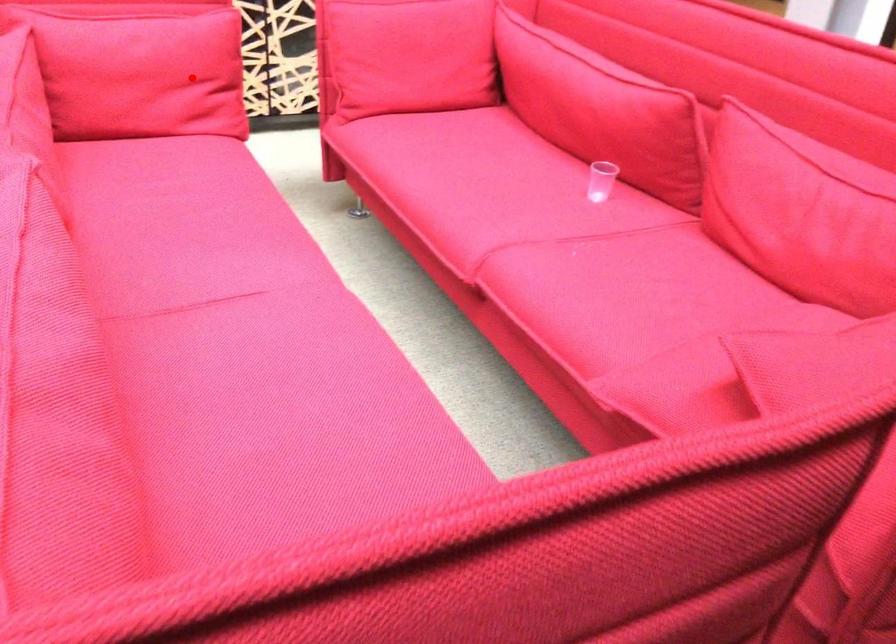
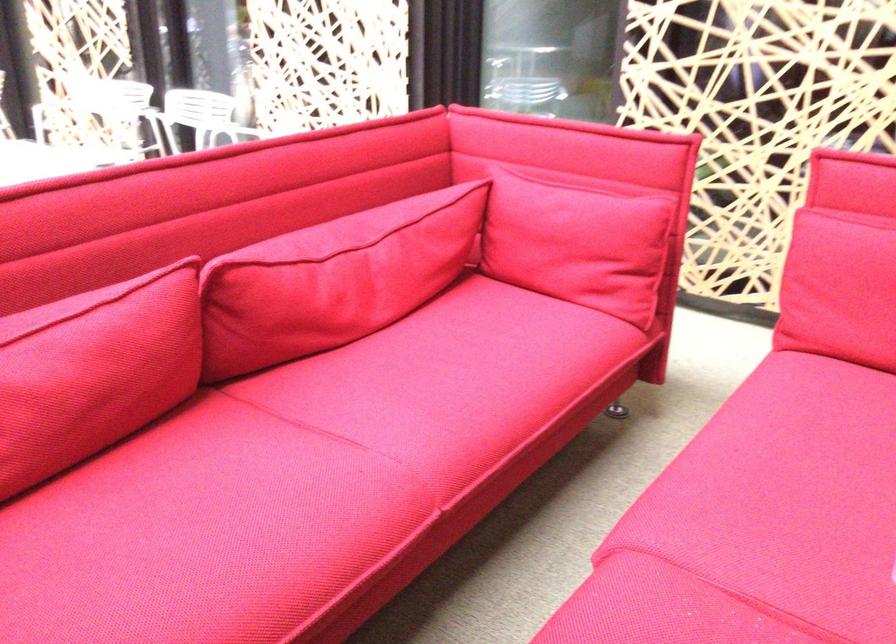
Find the pixel in the second image that matches the highlighted location in the first image.

(578, 243)